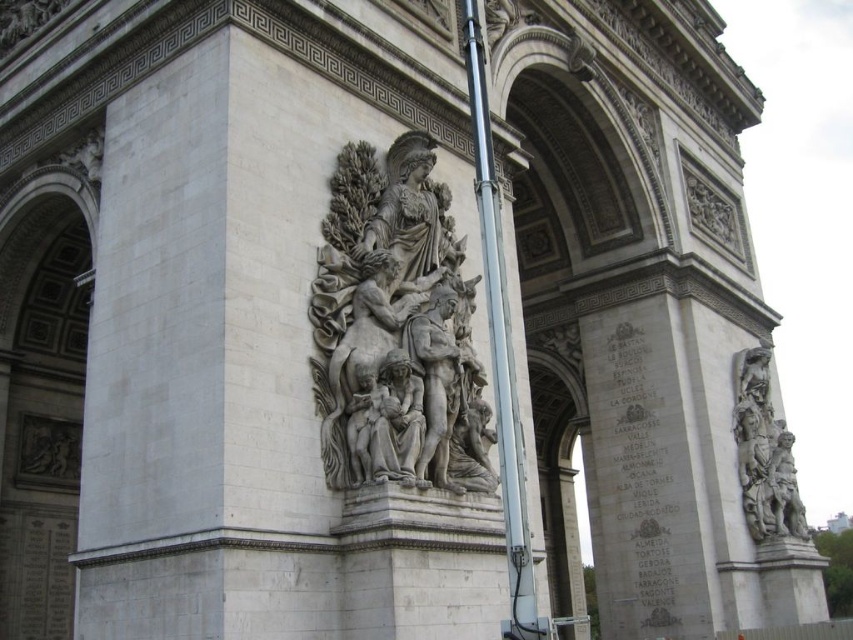
In the scene shown: Is white marble sculpture at center to the right of metallic silver pole at center from the viewer's perspective?

In fact, white marble sculpture at center is to the left of metallic silver pole at center.

Is white marble sculpture at center positioned at the back of metallic silver pole at center?

Yes, it is.

Between point (421, 362) and point (488, 298), which one is positioned in front?

Point (488, 298) is more forward.

The height and width of the screenshot is (640, 853). I want to click on white marble sculpture at center, so click(x=396, y=330).

Who is higher up, white marble sculpture at center or gray stone sculpture at right?

Positioned higher is white marble sculpture at center.

Is white marble sculpture at center below gray stone sculpture at right?

No.

Who is more distant from viewer, (453, 481) or (762, 396)?

The point (762, 396) is more distant.

The image size is (853, 640). I want to click on white marble sculpture at center, so click(x=396, y=330).

What do you see at coordinates (500, 349) in the screenshot?
I see `metallic silver pole at center` at bounding box center [500, 349].

Who is positioned more to the left, metallic silver pole at center or gray stone sculpture at right?

metallic silver pole at center is more to the left.

Describe the element at coordinates (500, 349) in the screenshot. This screenshot has height=640, width=853. I see `metallic silver pole at center` at that location.

Locate an element on the screen. The height and width of the screenshot is (640, 853). metallic silver pole at center is located at coordinates (500, 349).